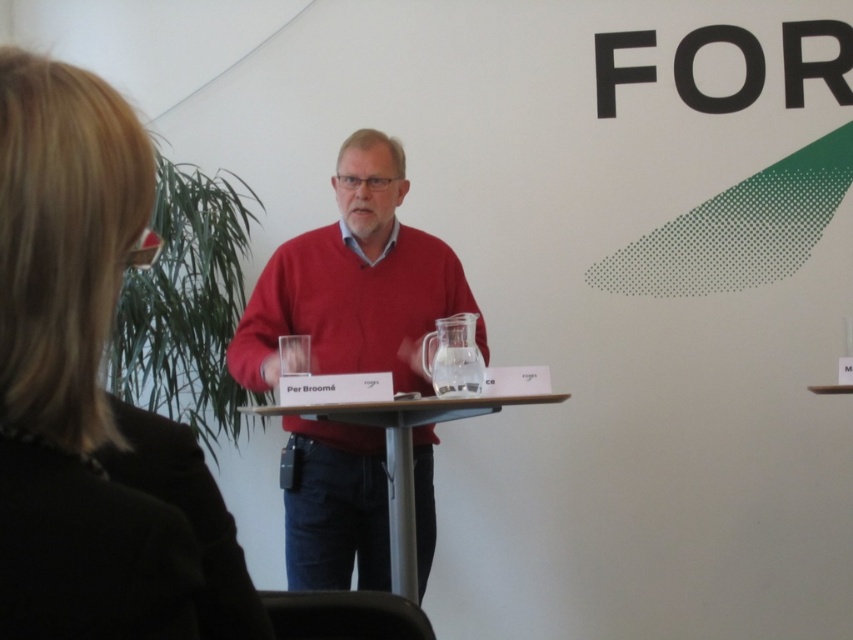
You are an event organizer who needs to adjust the lighting for the presentation. You notice the black fabric hair at upper left and the matte red sweater at center. Which object requires more light to ensure visibility?

The black fabric hair at upper left requires more light because it has a smaller size compared to the matte red sweater at center, making it potentially harder to see from a distance.